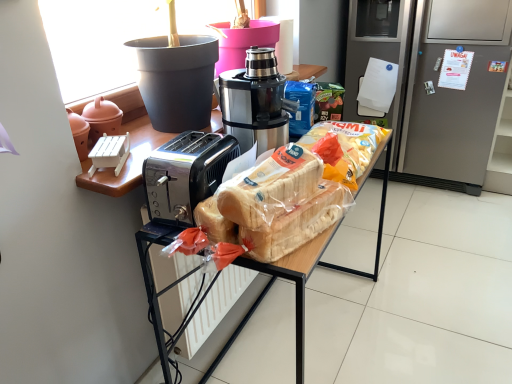
Question: Does satin black coffee maker at center have a smaller size compared to matte black toaster at center?

Choices:
 (A) no
 (B) yes

Answer: (B)

Question: From a real-world perspective, is satin black coffee maker at center under matte black toaster at center?

Choices:
 (A) no
 (B) yes

Answer: (A)

Question: Is satin black coffee maker at center shorter than matte black toaster at center?

Choices:
 (A) yes
 (B) no

Answer: (A)

Question: Considering the relative sizes of satin black coffee maker at center and matte black toaster at center in the image provided, is satin black coffee maker at center bigger than matte black toaster at center?

Choices:
 (A) no
 (B) yes

Answer: (A)

Question: Is matte black toaster at center a part of satin black coffee maker at center?

Choices:
 (A) no
 (B) yes

Answer: (A)

Question: From the image's perspective, is satin black coffee maker at center over matte black toaster at center?

Choices:
 (A) no
 (B) yes

Answer: (B)

Question: Can you confirm if translucent plastic bread at center is positioned to the left of satin black coffee maker at center?

Choices:
 (A) no
 (B) yes

Answer: (A)

Question: Does translucent plastic bread at center have a lesser width compared to satin black coffee maker at center?

Choices:
 (A) yes
 (B) no

Answer: (A)

Question: From the image's perspective, is translucent plastic bread at center under satin black coffee maker at center?

Choices:
 (A) no
 (B) yes

Answer: (B)

Question: Considering the relative sizes of translucent plastic bread at center and satin black coffee maker at center in the image provided, is translucent plastic bread at center shorter than satin black coffee maker at center?

Choices:
 (A) no
 (B) yes

Answer: (B)

Question: Does translucent plastic bread at center turn towards satin black coffee maker at center?

Choices:
 (A) no
 (B) yes

Answer: (A)

Question: Does translucent plastic bread at center contain satin black coffee maker at center?

Choices:
 (A) no
 (B) yes

Answer: (A)

Question: From a real-world perspective, is silver metallic refrigerator at right beneath translucent plastic bread at center?

Choices:
 (A) yes
 (B) no

Answer: (A)